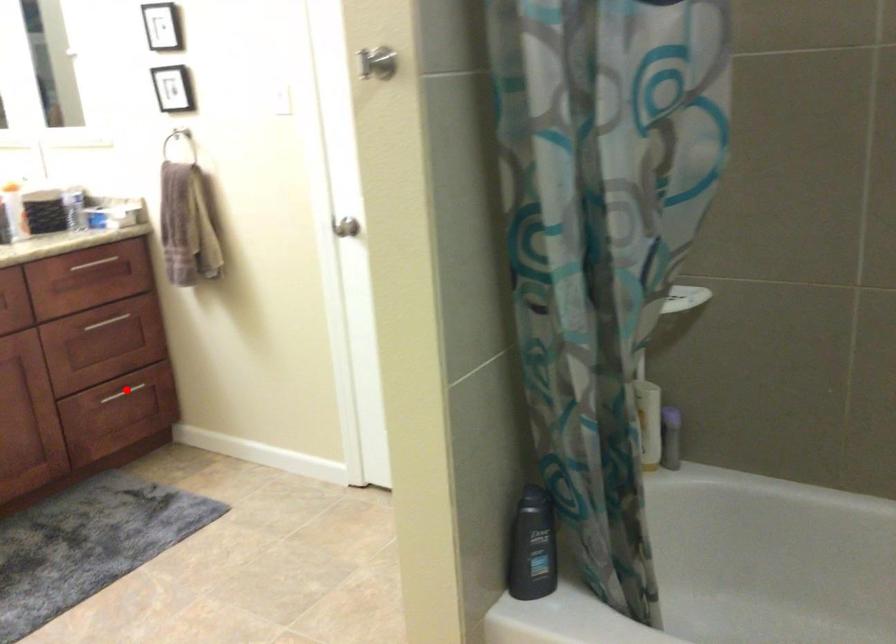
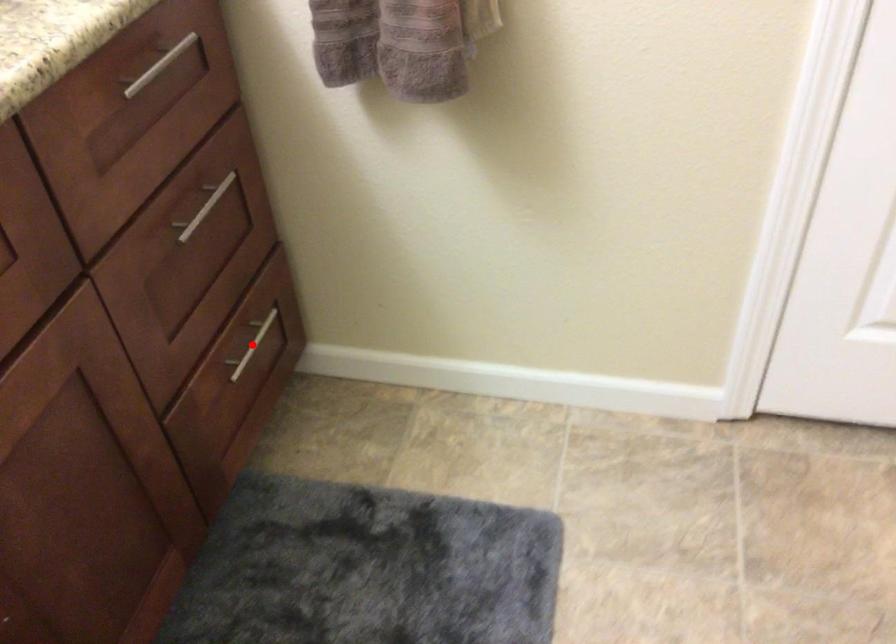
I am providing you with two images of the same scene from different viewpoints. A red point is marked on the first image and another point is marked on the second image. Does the point marked in image1 correspond to the same location as the one in image2?

Yes